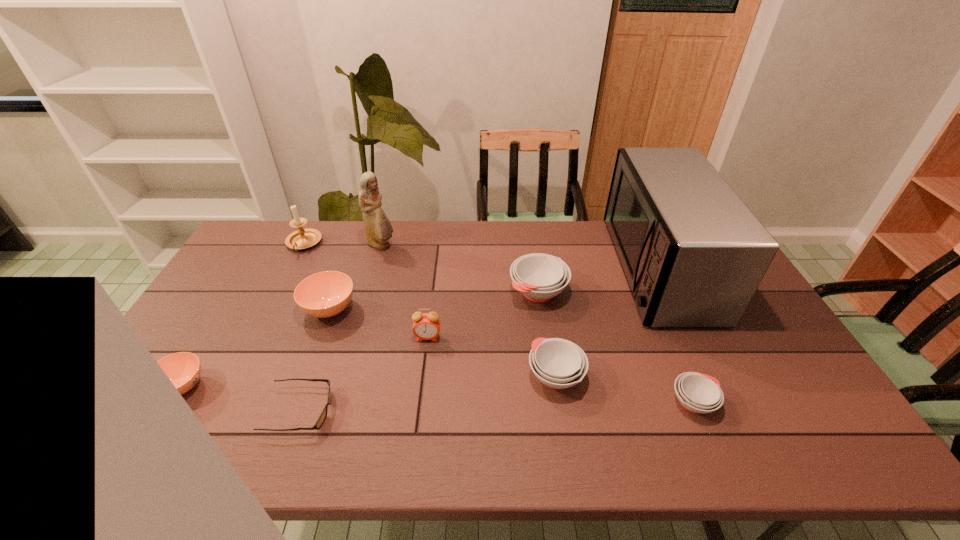
Where is `the leftmost soup bowl`? the leftmost soup bowl is located at coordinates (183, 369).

Where is `the nearer peach soup bowl`? The width and height of the screenshot is (960, 540). the nearer peach soup bowl is located at coordinates (183, 369).

The image size is (960, 540). What are the coordinates of `the rightmost soup bowl` in the screenshot? It's located at (698, 393).

What are the coordinates of `the smallest white soup bowl` in the screenshot? It's located at (698, 393).

You are a GUI agent. You are given a task and a screenshot of the screen. Output one action in this format:
    pyautogui.click(x=<x>, y=<y>)
    Task: Click on the shortest object
    
    Given the screenshot: What is the action you would take?
    pyautogui.click(x=322, y=417)

At what (x,y) coordinates should I click in order to perform the action: click on vacant region located on the front-facing side of the microwave_oven. Please return your answer as a coordinate pair (x, y). Looking at the image, I should click on (569, 268).

Image resolution: width=960 pixels, height=540 pixels. What are the coordinates of `vacant region located on the front-facing side of the microwave_oven` in the screenshot? It's located at (590, 268).

Where is `free space located 0.400m on the front-facing side of the microwave_oven`? The width and height of the screenshot is (960, 540). free space located 0.400m on the front-facing side of the microwave_oven is located at coordinates [499, 268].

Locate an element on the screen. vacant area located on the front-facing side of the figurine is located at coordinates (497, 245).

Locate an element on the screen. Image resolution: width=960 pixels, height=540 pixels. vacant region located with a handle on the side of the second object from left to right is located at coordinates (253, 345).